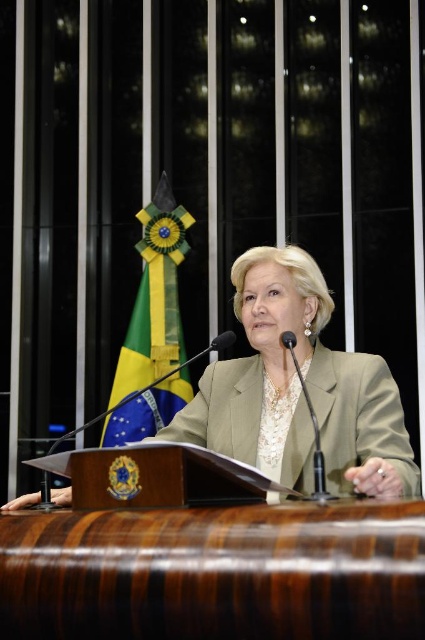
Question: Which point is closer to the camera?

Choices:
 (A) yellow-green fabric flag at left
 (B) matte beige blazer at center

Answer: (B)

Question: Does matte beige blazer at center appear on the left side of yellow-green fabric flag at left?

Choices:
 (A) yes
 (B) no

Answer: (B)

Question: Which point is closer to the camera taking this photo?

Choices:
 (A) (360, 412)
 (B) (121, 378)

Answer: (A)

Question: Where is matte beige blazer at center located in relation to yellow-green fabric flag at left in the image?

Choices:
 (A) above
 (B) below

Answer: (B)

Question: Is matte beige blazer at center wider than yellow-green fabric flag at left?

Choices:
 (A) no
 (B) yes

Answer: (B)

Question: Which point appears closest to the camera in this image?

Choices:
 (A) (255, 412)
 (B) (127, 340)

Answer: (A)